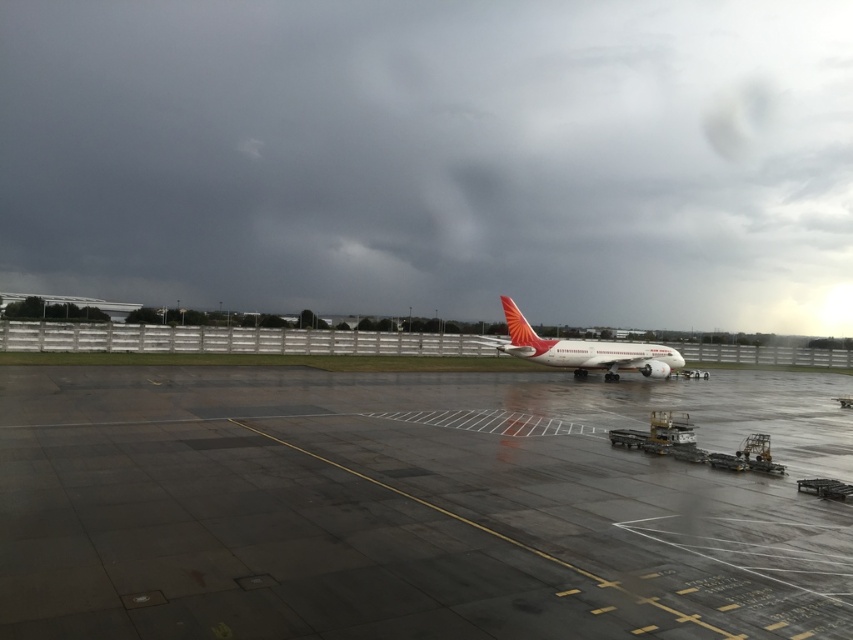
Does concrete wet tarmac at center appear on the left side of white matte airplane at center?

Indeed, concrete wet tarmac at center is positioned on the left side of white matte airplane at center.

Which is behind, point (312, 448) or point (546, 349)?

Positioned behind is point (546, 349).

Is point (614, 480) positioned after point (534, 349)?

No.

Find the location of `concrete wet tarmac at center`. concrete wet tarmac at center is located at coordinates (409, 508).

Which is in front, point (566, 42) or point (577, 374)?

Point (577, 374) is in front.

Between dark gray cloud at upper center and white matte airplane at center, which one is positioned higher?

dark gray cloud at upper center is higher up.

Measure the distance between dark gray cloud at upper center and camera.

They are 114.13 meters apart.

The image size is (853, 640). I want to click on dark gray cloud at upper center, so click(434, 156).

Does dark gray cloud at upper center have a greater width compared to concrete wet tarmac at center?

Correct, the width of dark gray cloud at upper center exceeds that of concrete wet tarmac at center.

Can you confirm if dark gray cloud at upper center is positioned to the right of concrete wet tarmac at center?

Yes, dark gray cloud at upper center is to the right of concrete wet tarmac at center.

The image size is (853, 640). What do you see at coordinates (434, 156) in the screenshot?
I see `dark gray cloud at upper center` at bounding box center [434, 156].

This screenshot has height=640, width=853. I want to click on dark gray cloud at upper center, so click(434, 156).